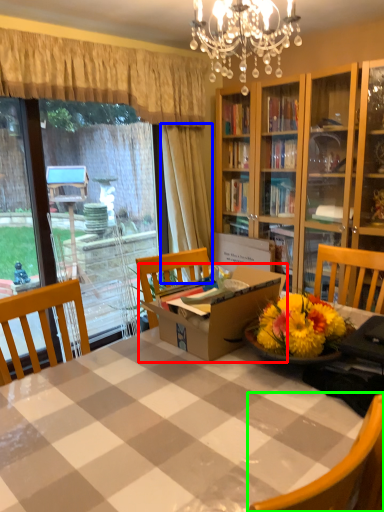
Question: Considering the real-world distances, which object is closest to box (highlighted by a red box)? curtain (highlighted by a blue box) or chair (highlighted by a green box).

Choices:
 (A) curtain
 (B) chair

Answer: (B)